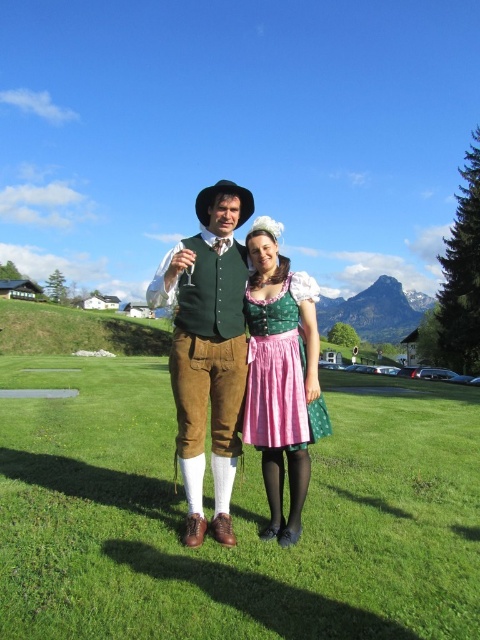
Question: Which point is closer to the camera?

Choices:
 (A) green satin dirndl at center
 (B) green velvety vest at center
 (C) green grass at center

Answer: (C)

Question: Which is nearer to the green grass at center?

Choices:
 (A) green velvety vest at center
 (B) green satin dirndl at center

Answer: (B)

Question: Which object is the closest to the green velvety vest at center?

Choices:
 (A) green grass at center
 (B) green satin dirndl at center

Answer: (B)

Question: Is green grass at center below green velvety vest at center?

Choices:
 (A) no
 (B) yes

Answer: (B)

Question: Can you confirm if green grass at center is thinner than green velvety vest at center?

Choices:
 (A) yes
 (B) no

Answer: (B)

Question: Is green velvety vest at center above green satin dirndl at center?

Choices:
 (A) yes
 (B) no

Answer: (A)